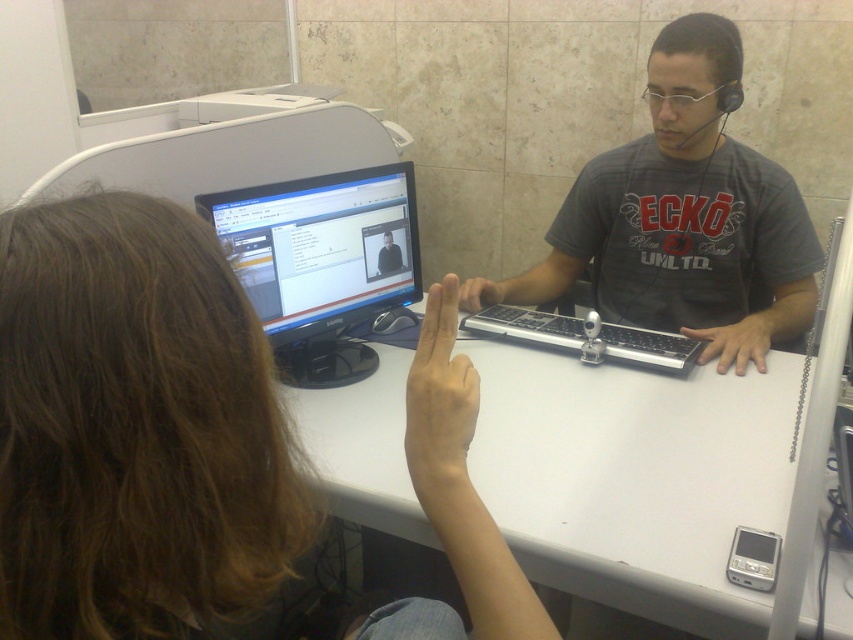
You are standing at the entrance of the office and see the white plastic table at center. Can you estimate its position relative to the entrance?

The white plastic table at center is located at point (x=636, y=480), which means it is positioned towards the right and slightly forward from the entrance.

You are a delivery person who needs to place a small package between the matte black monitor at upper center and the white plastic table at center. The package is 40 centimeters long. Will it fit in the space between them?

The space between the matte black monitor at upper center and the white plastic table at center is 41.47 centimeters. Since the package is 40 centimeters long, it will fit with a small amount of space remaining.

You are standing in front of the desk and want to place a new keyboard exactly where the matte black monitor at upper center is located. Is this possible?

The matte black monitor at upper center is positioned at coordinates point (135, 426), so placing a keyboard there would require removing the monitor first as they cannot occupy the same space.